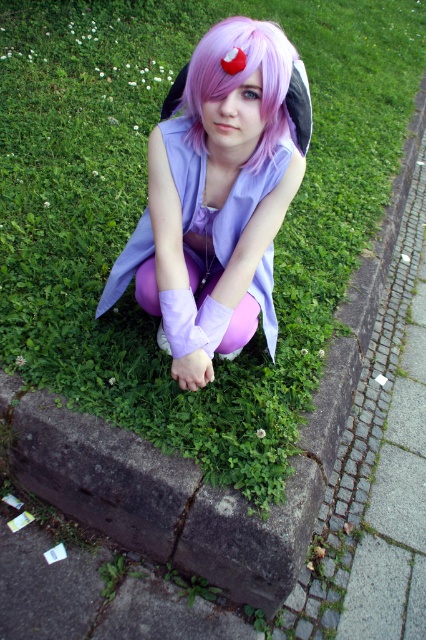
Question: Is lavender fabric dress at center closer to camera compared to purple matte wig at center?

Choices:
 (A) yes
 (B) no

Answer: (A)

Question: Does lavender fabric dress at center have a greater width compared to purple matte wig at center?

Choices:
 (A) yes
 (B) no

Answer: (A)

Question: Can you confirm if lavender fabric dress at center is positioned to the left of purple matte wig at center?

Choices:
 (A) yes
 (B) no

Answer: (A)

Question: Which point is closer to the camera?

Choices:
 (A) lavender fabric dress at center
 (B) purple matte wig at center

Answer: (A)

Question: Which point is farther to the camera?

Choices:
 (A) tap(307, 122)
 (B) tap(284, 176)

Answer: (A)

Question: Which of the following is the closest to the observer?

Choices:
 (A) lavender fabric dress at center
 (B) purple matte wig at center

Answer: (A)